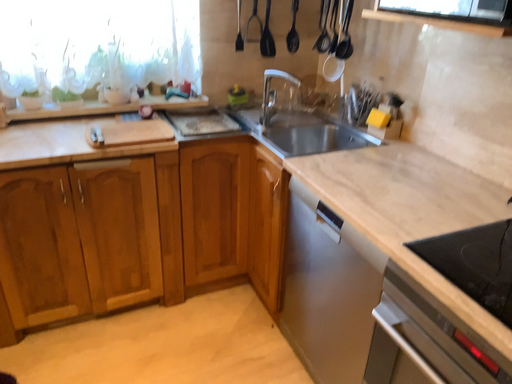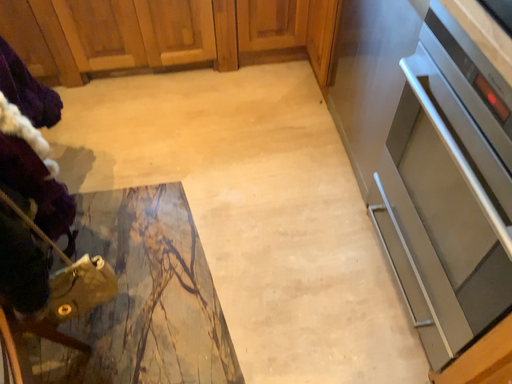
Question: Which way did the camera rotate in the video?

Choices:
 (A) rotated left
 (B) rotated right

Answer: (A)